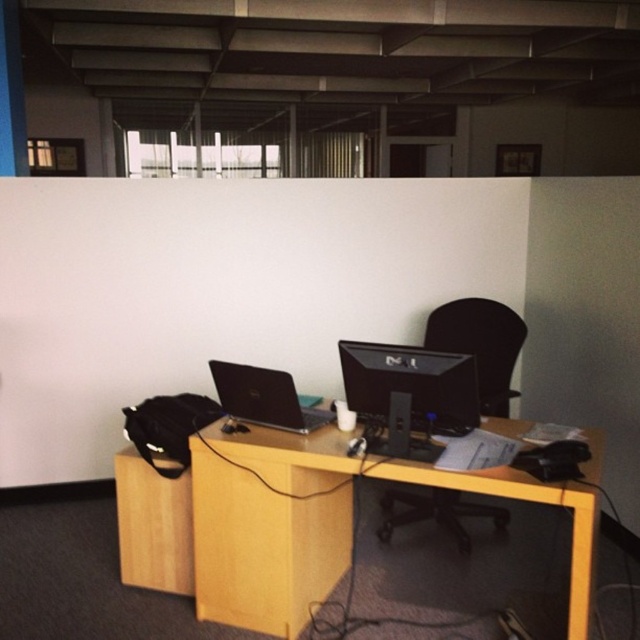
You are setting up a new webcam for video calls. The webcam needs to be placed on the desk such that it is directly above the Dell desktop computer monitor. Given the monitor is at coordinates black glossy monitor at center, can you confirm if placing the webcam at position point 0.617, 0.639 would align it correctly?

The black glossy monitor at center is located at point (x=408, y=394), so placing the webcam at that position would indeed align it directly above the monitor.